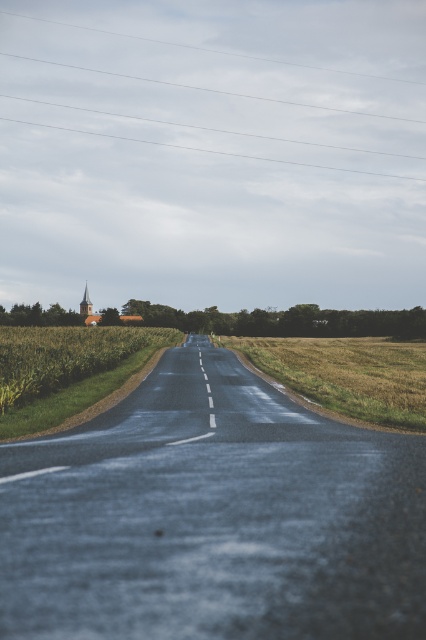
Is point (356, 387) less distant than point (129, 332)?

Yes, it is in front of point (129, 332).

The image size is (426, 640). Identify the location of golden grassy field at center. (348, 374).